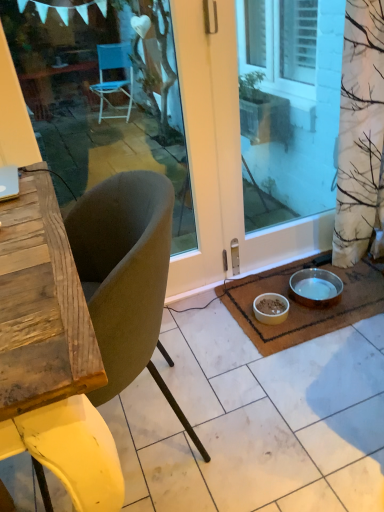
The height and width of the screenshot is (512, 384). Find the location of `brown woven mat at lower right`. brown woven mat at lower right is located at coordinates (303, 305).

Measure the distance between metallic silver bowl at lower right, the first bowl viewed from the right, and camera.

metallic silver bowl at lower right, the first bowl viewed from the right, is 1.73 meters away from camera.

The image size is (384, 512). Describe the element at coordinates (126, 276) in the screenshot. I see `velvet-like beige chair at center` at that location.

Image resolution: width=384 pixels, height=512 pixels. What do you see at coordinates (288, 106) in the screenshot?
I see `transparent glass door at center, the first window screen positioned from the right` at bounding box center [288, 106].

The height and width of the screenshot is (512, 384). I want to click on brown woven mat at lower right, so click(x=303, y=305).

Which of these two, transparent glass door at center, the second window screen in the left-to-right sequence, or white matte bowl at lower center, positioned as the second bowl in right-to-left order, stands taller?

With more height is transparent glass door at center, the second window screen in the left-to-right sequence.

Between transparent glass door at center, the second window screen in the left-to-right sequence, and white matte bowl at lower center, positioned as the second bowl in right-to-left order, which one is positioned behind?

white matte bowl at lower center, positioned as the second bowl in right-to-left order, is further from the camera.

From a real-world perspective, is transparent glass door at center, the second window screen in the left-to-right sequence, physically below white matte bowl at lower center, the first bowl viewed from the left?

No, from a real-world perspective, transparent glass door at center, the second window screen in the left-to-right sequence, is not beneath white matte bowl at lower center, the first bowl viewed from the left.

Can white matte bowl at lower center, the first bowl viewed from the left, be found inside transparent glass door at center, the second window screen in the left-to-right sequence?

Definitely not — white matte bowl at lower center, the first bowl viewed from the left, is not inside transparent glass door at center, the second window screen in the left-to-right sequence.

From a real-world perspective, who is located higher, white matte bowl at lower center, positioned as the second bowl in right-to-left order, or transparent glass door at center, the second window screen in the left-to-right sequence?

transparent glass door at center, the second window screen in the left-to-right sequence.

Which object is further away from the camera, white matte bowl at lower center, the first bowl viewed from the left, or transparent glass door at center, the first window screen positioned from the right?

white matte bowl at lower center, the first bowl viewed from the left.

From the picture: Is white matte bowl at lower center, positioned as the second bowl in right-to-left order, positioned with its back to transparent glass door at center, the first window screen positioned from the right?

That's not correct — white matte bowl at lower center, positioned as the second bowl in right-to-left order, is not looking away from transparent glass door at center, the first window screen positioned from the right.

Would you say white matte bowl at lower center, the first bowl viewed from the left, is a long distance from transparent glass door at center, the second window screen in the left-to-right sequence?

white matte bowl at lower center, the first bowl viewed from the left, is far away from transparent glass door at center, the second window screen in the left-to-right sequence.

How many degrees apart are the facing directions of white matte bowl at lower center, positioned as the second bowl in right-to-left order, and transparent glass door at center, placed as the 1th window screen when sorted from left to right?

The angle between the facing direction of white matte bowl at lower center, positioned as the second bowl in right-to-left order, and the facing direction of transparent glass door at center, placed as the 1th window screen when sorted from left to right, is 0.0899 degrees.

Is white matte bowl at lower center, positioned as the second bowl in right-to-left order, in contact with transparent glass door at center, placed as the 1th window screen when sorted from left to right?

No, white matte bowl at lower center, positioned as the second bowl in right-to-left order, is not beside transparent glass door at center, placed as the 1th window screen when sorted from left to right.

Who is smaller, white matte bowl at lower center, positioned as the second bowl in right-to-left order, or transparent glass door at center, placed as the 1th window screen when sorted from left to right?

white matte bowl at lower center, positioned as the second bowl in right-to-left order.

From a real-world perspective, which object stands above the other?

transparent glass door at center, the second window screen in the right-to-left sequence.

Relative to transparent glass door at center, the second window screen in the right-to-left sequence, is brown woven mat at lower right in front or behind?

Visually, brown woven mat at lower right is located behind transparent glass door at center, the second window screen in the right-to-left sequence.

Is brown woven mat at lower right oriented away from transparent glass door at center, the second window screen in the right-to-left sequence?

No.

From a real-world perspective, is brown woven mat at lower right beneath transparent glass door at center, placed as the 1th window screen when sorted from left to right?

Yes.

Considering the relative sizes of brown woven mat at lower right and transparent glass door at center, placed as the 1th window screen when sorted from left to right, in the image provided, is brown woven mat at lower right bigger than transparent glass door at center, placed as the 1th window screen when sorted from left to right,?

Actually, brown woven mat at lower right might be smaller than transparent glass door at center, placed as the 1th window screen when sorted from left to right.

Which is correct: metallic silver bowl at lower right, marked as the second bowl in a left-to-right arrangement, is inside transparent glass door at center, placed as the 1th window screen when sorted from left to right, or outside of it?

metallic silver bowl at lower right, marked as the second bowl in a left-to-right arrangement, is not inside transparent glass door at center, placed as the 1th window screen when sorted from left to right, it's outside.

Does metallic silver bowl at lower right, the first bowl viewed from the right, have a larger size compared to transparent glass door at center, placed as the 1th window screen when sorted from left to right?

No.

In terms of width, does metallic silver bowl at lower right, marked as the second bowl in a left-to-right arrangement, look wider or thinner when compared to transparent glass door at center, the second window screen in the right-to-left sequence?

metallic silver bowl at lower right, marked as the second bowl in a left-to-right arrangement, is wider than transparent glass door at center, the second window screen in the right-to-left sequence.

Which object is thinner, velvet-like beige chair at center or brown woven mat at lower right?

Thinner between the two is velvet-like beige chair at center.

From the image's perspective, which one is positioned lower, velvet-like beige chair at center or brown woven mat at lower right?

velvet-like beige chair at center appears lower in the image.

From a real-world perspective, which object stands above the other?

velvet-like beige chair at center, from a real-world perspective.

How far apart are velvet-like beige chair at center and brown woven mat at lower right?

The distance of velvet-like beige chair at center from brown woven mat at lower right is 76.58 centimeters.

From a real-world perspective, is transparent glass door at center, placed as the 1th window screen when sorted from left to right, above or below velvet-like beige chair at center?

transparent glass door at center, placed as the 1th window screen when sorted from left to right, is above velvet-like beige chair at center.

Is transparent glass door at center, placed as the 1th window screen when sorted from left to right, wider or thinner than velvet-like beige chair at center?

Clearly, transparent glass door at center, placed as the 1th window screen when sorted from left to right, has less width compared to velvet-like beige chair at center.

From the image's perspective, between transparent glass door at center, placed as the 1th window screen when sorted from left to right, and velvet-like beige chair at center, who is located below?

velvet-like beige chair at center.

Is transparent glass door at center, the second window screen in the right-to-left sequence, at the left side of velvet-like beige chair at center?

Indeed, transparent glass door at center, the second window screen in the right-to-left sequence, is positioned on the left side of velvet-like beige chair at center.

Find the location of a particular element. This screenshot has width=384, height=512. window screen that is the 1st object located in front of the white matte bowl at lower center, positioned as the second bowl in right-to-left order is located at coordinates (288, 106).

I want to click on the 2nd bowl positioned below the transparent glass door at center, the second window screen in the left-to-right sequence (from the image's perspective), so click(x=271, y=308).

From the image, which object appears to be farther from transparent glass door at center, placed as the 1th window screen when sorted from left to right, transparent glass door at center, the first window screen positioned from the right, or metallic silver bowl at lower right, marked as the second bowl in a left-to-right arrangement?

metallic silver bowl at lower right, marked as the second bowl in a left-to-right arrangement, lies further to transparent glass door at center, placed as the 1th window screen when sorted from left to right, than the other object.

Looking at the image, which one is located closer to white matte bowl at lower center, positioned as the second bowl in right-to-left order, velvet-like beige chair at center or brown woven mat at lower right?

brown woven mat at lower right.

Based on their spatial positions, is white matte bowl at lower center, positioned as the second bowl in right-to-left order, or velvet-like beige chair at center further from transparent glass door at center, placed as the 1th window screen when sorted from left to right?

white matte bowl at lower center, positioned as the second bowl in right-to-left order, is further to transparent glass door at center, placed as the 1th window screen when sorted from left to right.

When comparing their distances from transparent glass door at center, the first window screen positioned from the right, does velvet-like beige chair at center or metallic silver bowl at lower right, the first bowl viewed from the right, seem closer?

metallic silver bowl at lower right, the first bowl viewed from the right, is positioned closer to the anchor transparent glass door at center, the first window screen positioned from the right.

When comparing their distances from white matte bowl at lower center, positioned as the second bowl in right-to-left order, does transparent glass door at center, the first window screen positioned from the right, or transparent glass door at center, placed as the 1th window screen when sorted from left to right, seem closer?

transparent glass door at center, the first window screen positioned from the right.

Looking at the image, which one is located closer to velvet-like beige chair at center, metallic silver bowl at lower right, marked as the second bowl in a left-to-right arrangement, or transparent glass door at center, the second window screen in the left-to-right sequence?

The object closer to velvet-like beige chair at center is metallic silver bowl at lower right, marked as the second bowl in a left-to-right arrangement.

Looking at the image, which one is located closer to velvet-like beige chair at center, metallic silver bowl at lower right, marked as the second bowl in a left-to-right arrangement, or brown woven mat at lower right?

Among the two, brown woven mat at lower right is located nearer to velvet-like beige chair at center.

Based on their spatial positions, is metallic silver bowl at lower right, marked as the second bowl in a left-to-right arrangement, or white matte bowl at lower center, positioned as the second bowl in right-to-left order, closer to velvet-like beige chair at center?

white matte bowl at lower center, positioned as the second bowl in right-to-left order.

I want to click on window screen between transparent glass door at center, the second window screen in the right-to-left sequence, and metallic silver bowl at lower right, the first bowl viewed from the right, in the horizontal direction, so click(x=288, y=106).

Identify the location of bowl between transparent glass door at center, the second window screen in the left-to-right sequence, and white matte bowl at lower center, the first bowl viewed from the left, in the up-down direction. The image size is (384, 512). (316, 287).

Where is `window screen between transparent glass door at center, the second window screen in the right-to-left sequence, and brown woven mat at lower right from left to right`? window screen between transparent glass door at center, the second window screen in the right-to-left sequence, and brown woven mat at lower right from left to right is located at coordinates (288, 106).

I want to click on doormat between transparent glass door at center, placed as the 1th window screen when sorted from left to right, and metallic silver bowl at lower right, marked as the second bowl in a left-to-right arrangement, so click(x=303, y=305).